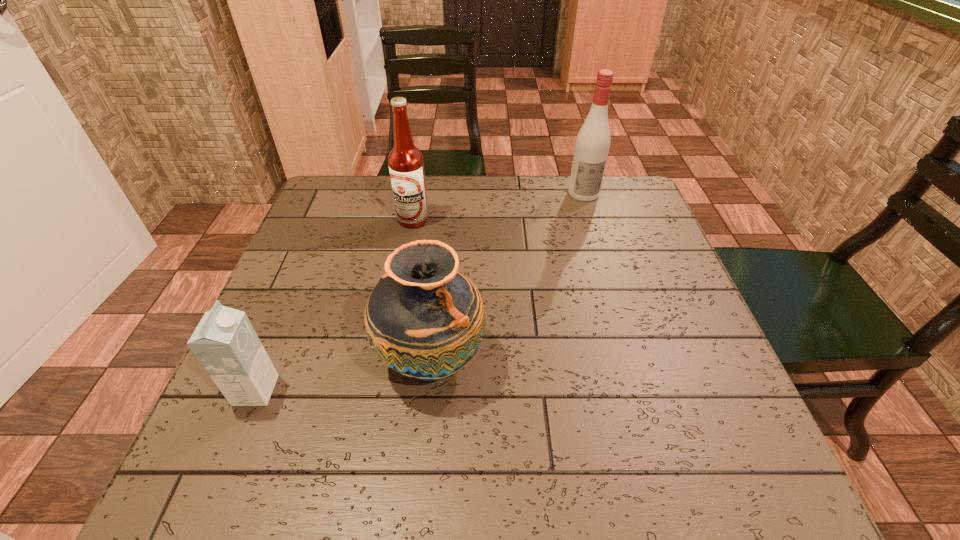
This screenshot has height=540, width=960. Identify the location of vacant area at the near right corner of the desktop. (743, 481).

Identify the location of free spot between the rightmost object and the second shortest object. The width and height of the screenshot is (960, 540). (507, 276).

Find the location of a particular element. The height and width of the screenshot is (540, 960). vacant area between the carton and the third tallest object is located at coordinates (344, 375).

Locate an element on the screen. The width and height of the screenshot is (960, 540). vacant point located between the nearer alcohol and the shortest object is located at coordinates (334, 305).

Locate an element on the screen. Image resolution: width=960 pixels, height=540 pixels. vacant space that is in between the rightmost object and the pottery is located at coordinates (507, 276).

Where is `vacant area that lies between the farther alcohol and the nearer alcohol`? Image resolution: width=960 pixels, height=540 pixels. vacant area that lies between the farther alcohol and the nearer alcohol is located at coordinates pyautogui.click(x=498, y=206).

Find the location of a particular element. The image size is (960, 540). free space between the third tallest object and the farther alcohol is located at coordinates (507, 276).

I want to click on free space between the right alcohol and the second shortest object, so click(507, 276).

Locate an element on the screen. unoccupied position between the nearer alcohol and the shortest object is located at coordinates (334, 305).

Identify which object is located as the nearest to the carton. Please provide its 2D coordinates. Your answer should be formatted as a tuple, i.e. [(x, y)], where the tuple contains the x and y coordinates of a point satisfying the conditions above.

[(423, 319)]